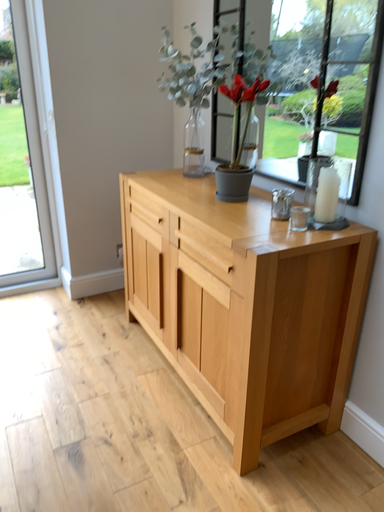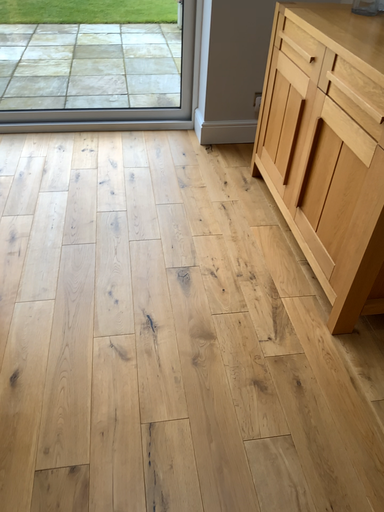
Question: Which way did the camera rotate in the video?

Choices:
 (A) rotated left
 (B) rotated right

Answer: (A)